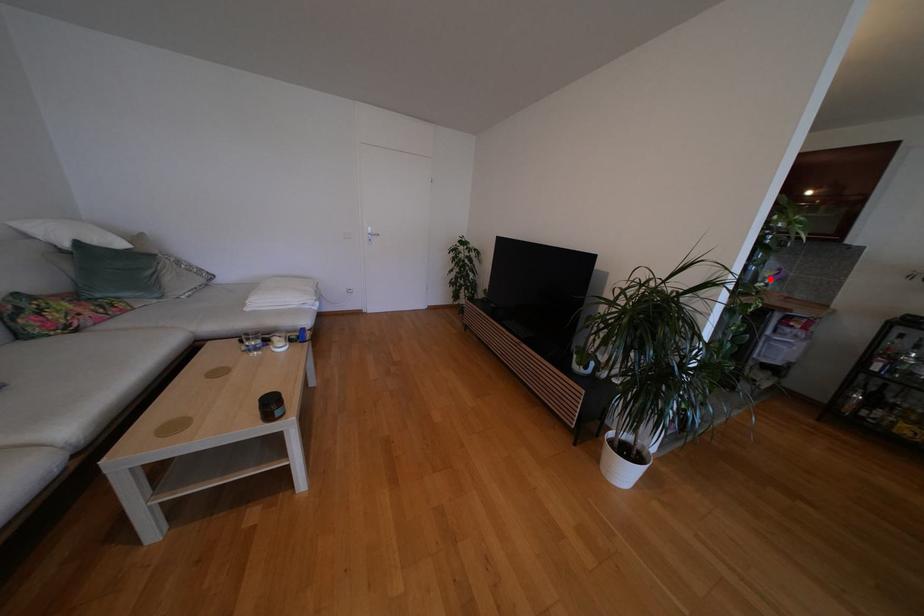
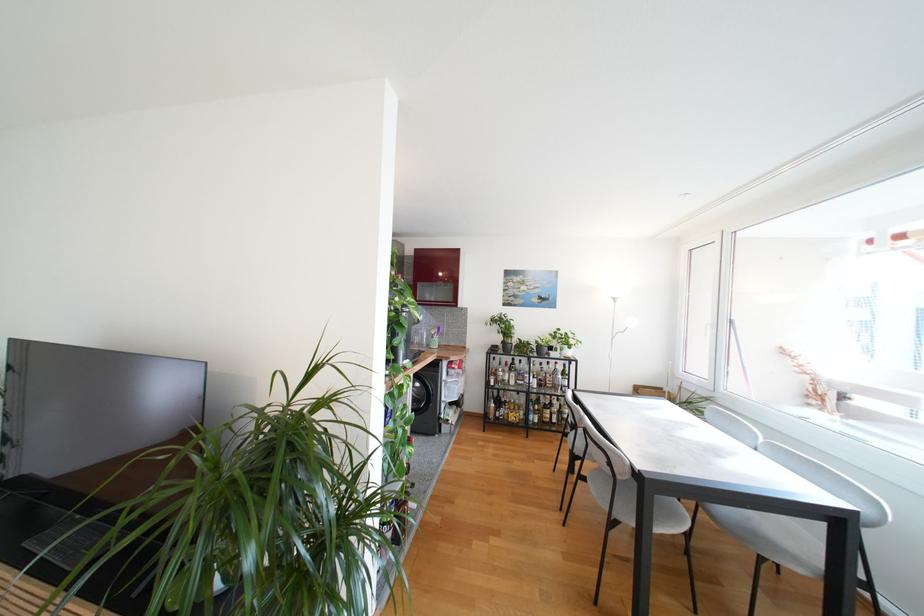
Locate, in the second image, the point that corresponds to the highlighted location in the first image.

(436, 336)